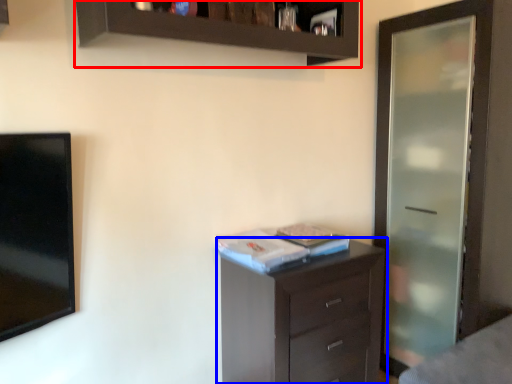
Question: Which point is further to the camera, cupboard (highlighted by a red box) or chest of drawers (highlighted by a blue box)?

Choices:
 (A) cupboard
 (B) chest of drawers

Answer: (B)